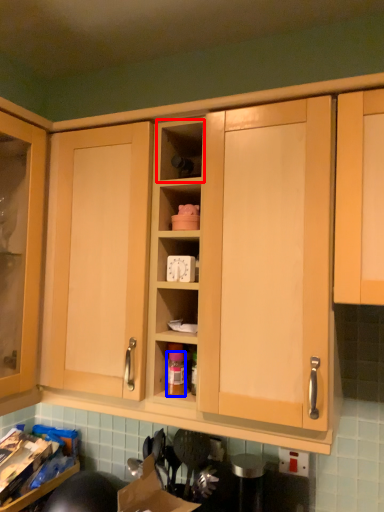
Question: Which of the following is the closest to the observer, shelf (highlighted by a red box) or bottle (highlighted by a blue box)?

Choices:
 (A) shelf
 (B) bottle

Answer: (A)